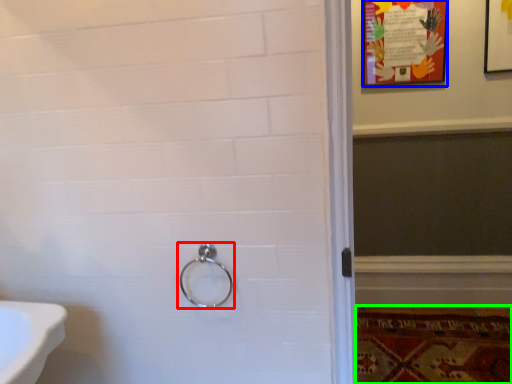
Question: Which is farther away from door handle (highlighted by a red box)? poster page (highlighted by a blue box) or mat (highlighted by a green box)?

Choices:
 (A) poster page
 (B) mat

Answer: (A)